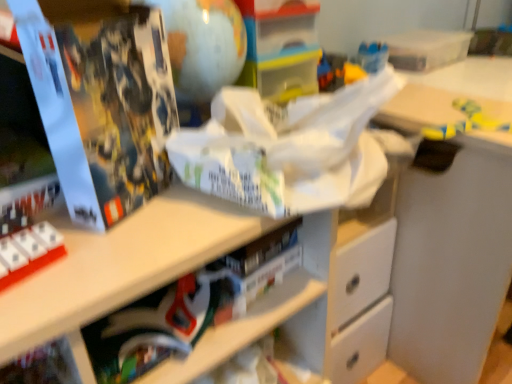
Question: Considering the positions of matte black book at lower center and yellow matte toy at upper right in the image, is matte black book at lower center taller or shorter than yellow matte toy at upper right?

Choices:
 (A) short
 (B) tall

Answer: (B)

Question: Based on their sizes in the image, would you say matte black book at lower center is bigger or smaller than yellow matte toy at upper right?

Choices:
 (A) small
 (B) big

Answer: (B)

Question: Considering the real-world distances, which object is closest to the yellow matte toy at upper right?

Choices:
 (A) matte black book at lower center
 (B) matte black book at left

Answer: (A)

Question: Which of these objects is positioned closest to the matte black book at lower center?

Choices:
 (A) matte black book at left
 (B) yellow matte toy at upper right

Answer: (A)